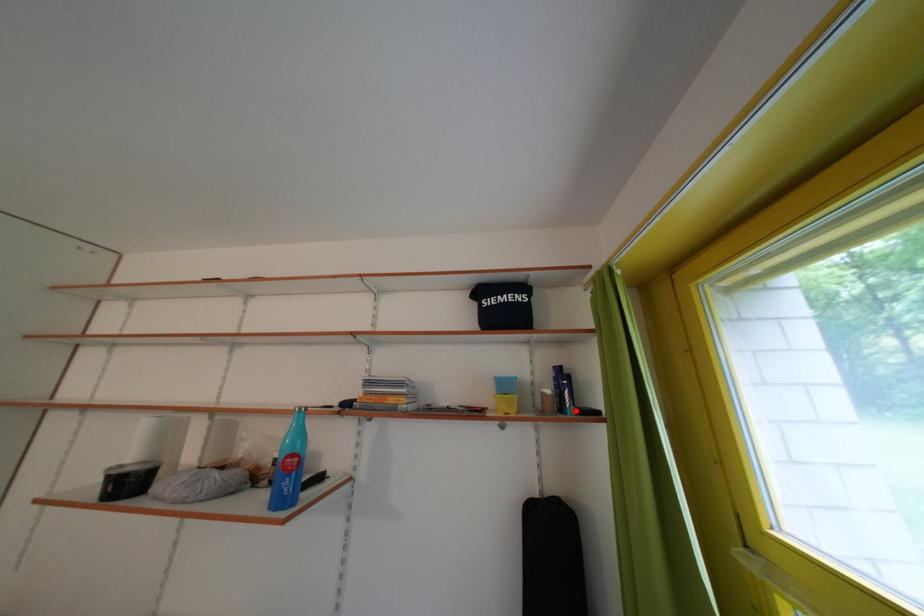
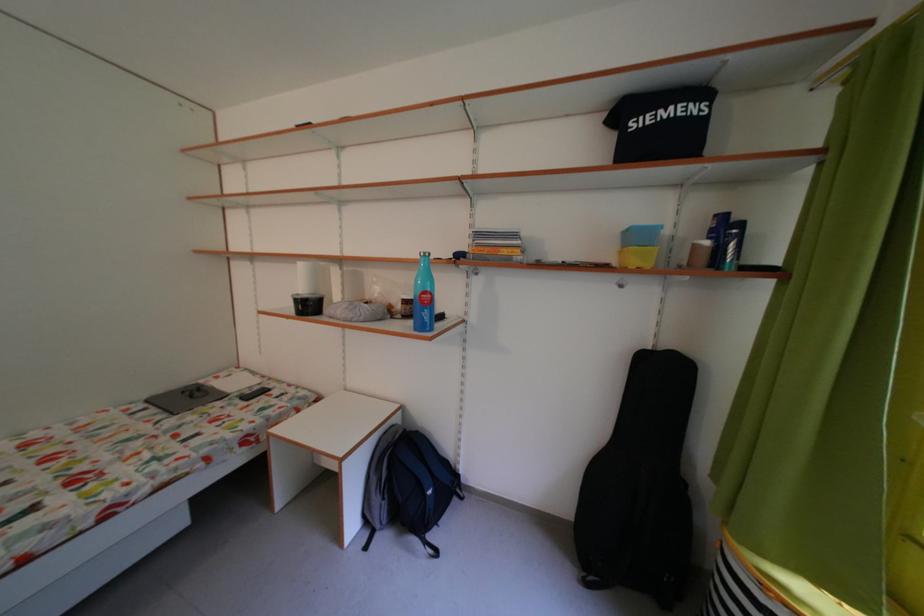
Where in the second image is the point corresponding to the highlighted location from the first image?

(736, 265)